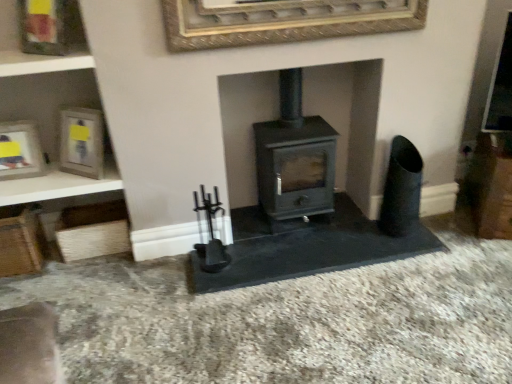
Identify the location of free spot in front of matte gray wood burning stove at center. (300, 255).